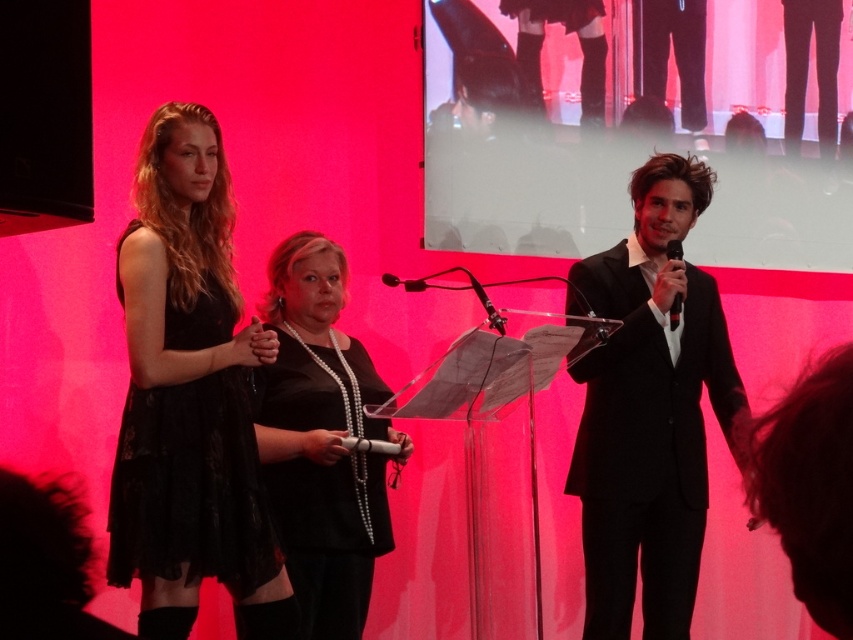
Can you confirm if black satin suit at right is shorter than black pearl necklace at center?

Incorrect, black satin suit at right's height does not fall short of black pearl necklace at center's.

Is point (660, 422) more distant than point (347, 586)?

Yes, point (660, 422) is behind point (347, 586).

Is point (712, 326) farther from camera compared to point (318, 413)?

Yes, it is behind point (318, 413).

Find the location of a particular element. This screenshot has width=853, height=640. black satin suit at right is located at coordinates [x=650, y=410].

Does black plastic microphone at right have a greater height compared to black plastic microphone at center?

Correct, black plastic microphone at right is much taller as black plastic microphone at center.

Is black plastic microphone at right wider than black plastic microphone at center?

No, black plastic microphone at right is not wider than black plastic microphone at center.

Locate an element on the screen. black plastic microphone at right is located at coordinates (675, 310).

This screenshot has width=853, height=640. What do you see at coordinates (190, 486) in the screenshot? I see `lace black dress at left` at bounding box center [190, 486].

Between lace black dress at left and black plastic microphone at center, which one has more height?

With more height is lace black dress at left.

Locate an element on the screen. The height and width of the screenshot is (640, 853). lace black dress at left is located at coordinates (190, 486).